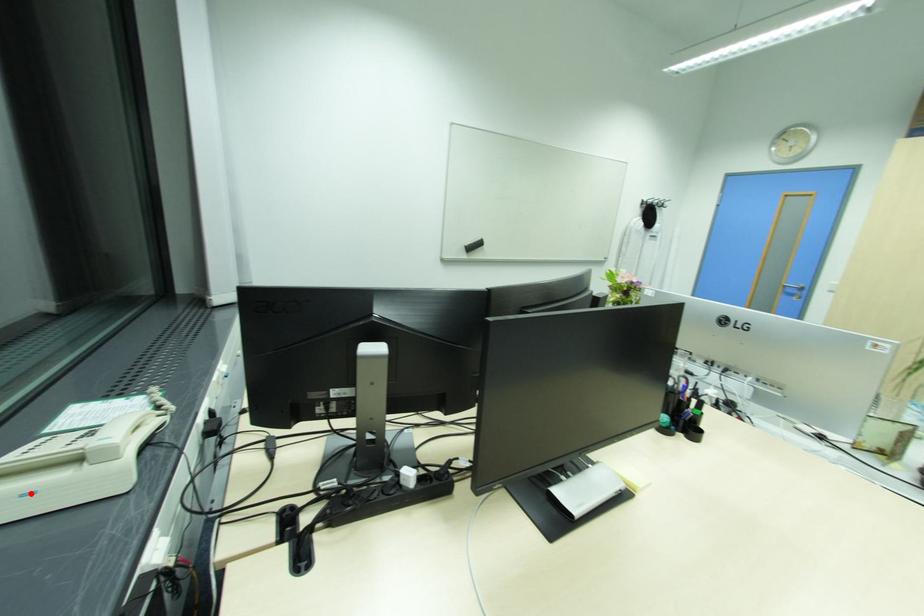
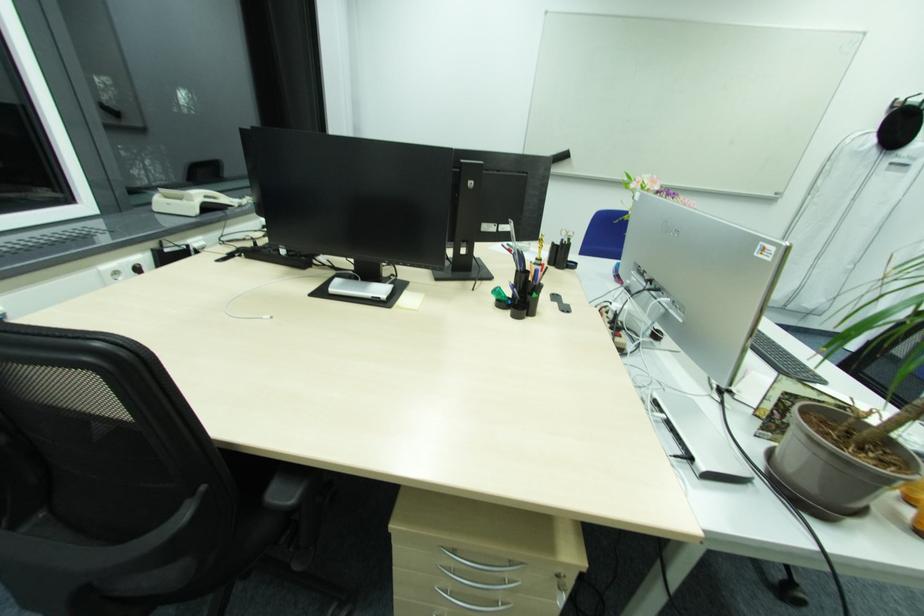
Question: I am providing you with two images of the same scene from different viewpoints. A red point is marked on the first image. Is the red point's position out of view in image 2?

Choices:
 (A) Yes
 (B) No

Answer: (B)